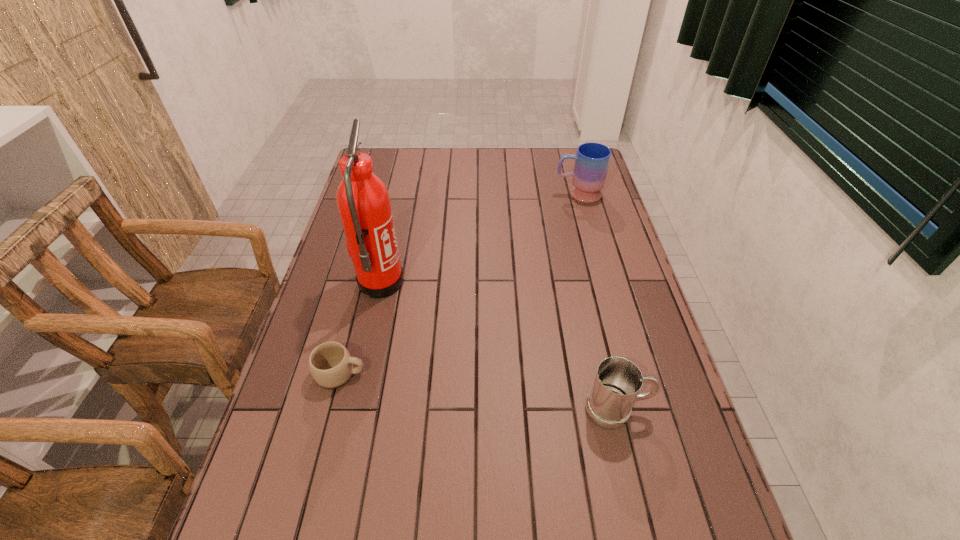
Find the location of `object that is the third closest to the shortest mug`. object that is the third closest to the shortest mug is located at coordinates (592, 160).

Identify which mug is the closest to the second tallest object. Please provide its 2D coordinates. Your answer should be formatted as a tuple, i.e. [(x, y)], where the tuple contains the x and y coordinates of a point satisfying the conditions above.

[(617, 382)]

Find the location of a particular element. the closest mug to the second shortest mug is located at coordinates (330, 363).